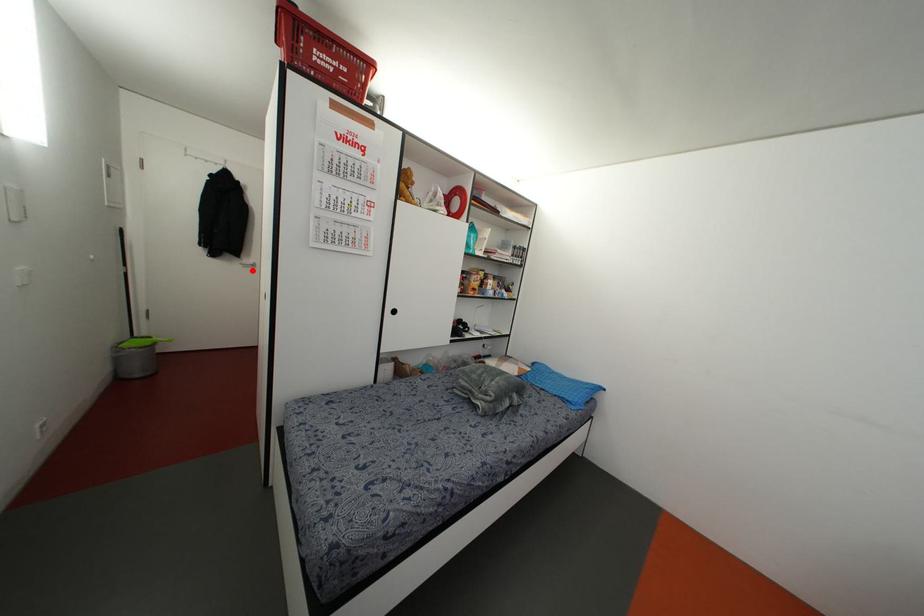
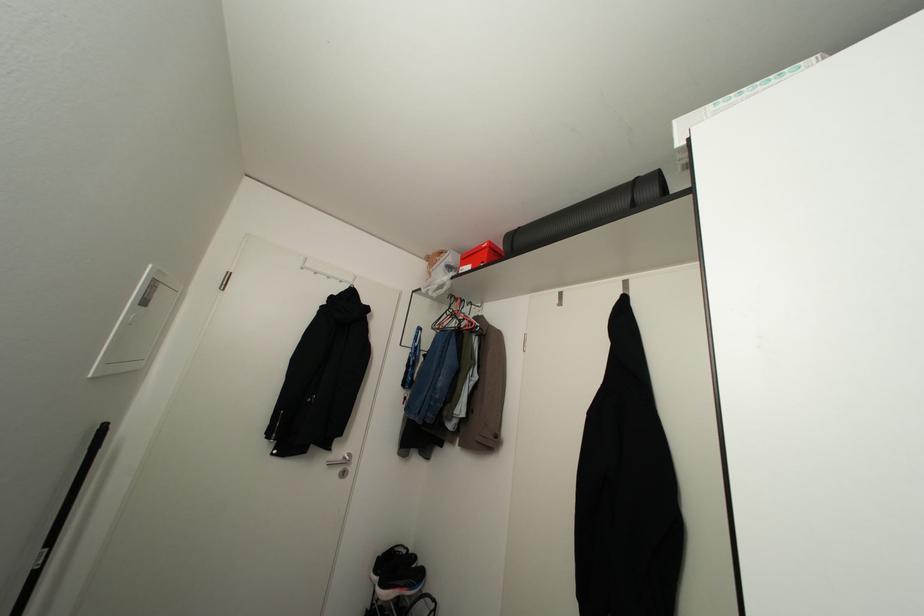
Question: A red point is marked in image1. In image2, is the corresponding 3D point closer to the camera or farther? Reply with the corresponding letter.

Choices:
 (A) The corresponding 3D point is closer.
 (B) The corresponding 3D point is farther.

Answer: (B)